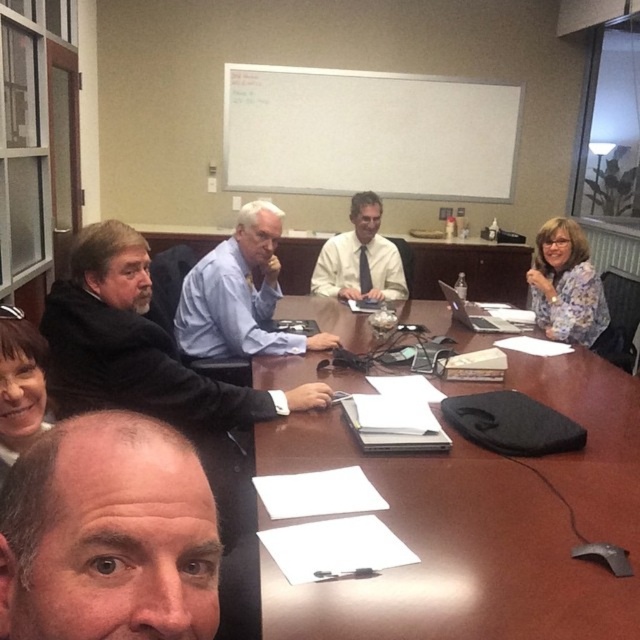
Does smooth skin face at lower left have a greater height compared to blue shirt at center?

No, smooth skin face at lower left is not taller than blue shirt at center.

Does point (189, 525) come closer to viewer compared to point (284, 352)?

Yes, point (189, 525) is closer to viewer.

Locate an element on the screen. This screenshot has width=640, height=640. smooth skin face at lower left is located at coordinates (108, 536).

From the picture: Does brown wooden table at center appear over smooth skin face at lower left?

No.

Is brown wooden table at center positioned at the back of smooth skin face at lower left?

Yes, brown wooden table at center is behind smooth skin face at lower left.

Is point (406, 596) less distant than point (104, 452)?

That is False.

At what (x,y) coordinates should I click in order to perform the action: click on brown wooden table at center. Please return your answer as a coordinate pair (x, y). The width and height of the screenshot is (640, 640). Looking at the image, I should click on (480, 522).

Can you confirm if brown wooden table at center is smaller than black matte jacket at left?

No.

Measure the distance between brown wooden table at center and camera.

brown wooden table at center is 1.15 meters away from camera.

The width and height of the screenshot is (640, 640). I want to click on brown wooden table at center, so click(480, 522).